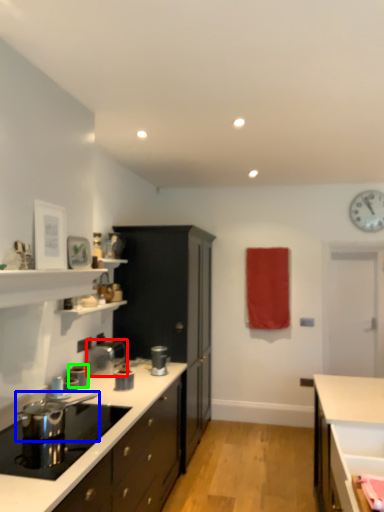
Question: Estimate the real-world distances between objects in this image. Which object is closer to appliance (highlighted by a red box), appliance (highlighted by a blue box) or kitchen appliance (highlighted by a green box)?

Choices:
 (A) appliance
 (B) kitchen appliance

Answer: (B)